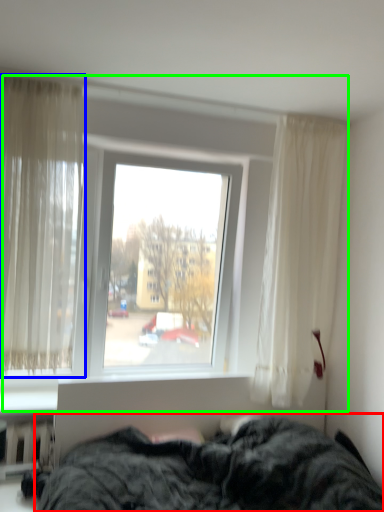
Question: Estimate the real-world distances between objects in this image. Which object is farther from bed (highlighted by a red box), curtain (highlighted by a blue box) or window (highlighted by a green box)?

Choices:
 (A) curtain
 (B) window

Answer: (A)